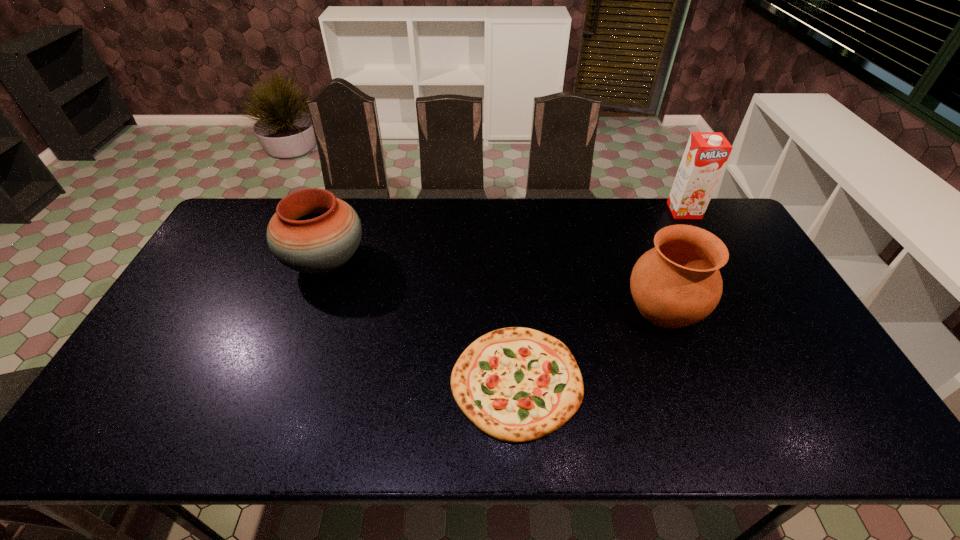
Find the location of a particular element. This screenshot has height=540, width=960. empty location between the pizza and the second object from right to left is located at coordinates (590, 345).

This screenshot has height=540, width=960. What are the coordinates of `vacant area that lies between the right pottery and the leftmost object` in the screenshot? It's located at (495, 285).

Locate an element on the screen. The image size is (960, 540). empty space that is in between the carton and the pizza is located at coordinates pyautogui.click(x=600, y=296).

This screenshot has width=960, height=540. In order to click on free spot between the leftmost object and the second object from right to left in this screenshot , I will do `click(495, 285)`.

Find the location of a particular element. This screenshot has height=540, width=960. free area in between the second object from right to left and the leftmost object is located at coordinates (495, 285).

Locate an element on the screen. vacant region between the farthest object and the leftmost object is located at coordinates (505, 237).

Find the location of a particular element. The width and height of the screenshot is (960, 540). free point between the tallest object and the pizza is located at coordinates (600, 296).

Locate an element on the screen. The width and height of the screenshot is (960, 540). empty space between the right pottery and the leftmost object is located at coordinates (495, 285).

Identify the location of object that ranks as the closest to the second object from left to right. (677, 283).

Find the location of a particular element. This screenshot has width=960, height=540. object that is the closest to the farthest object is located at coordinates (677, 283).